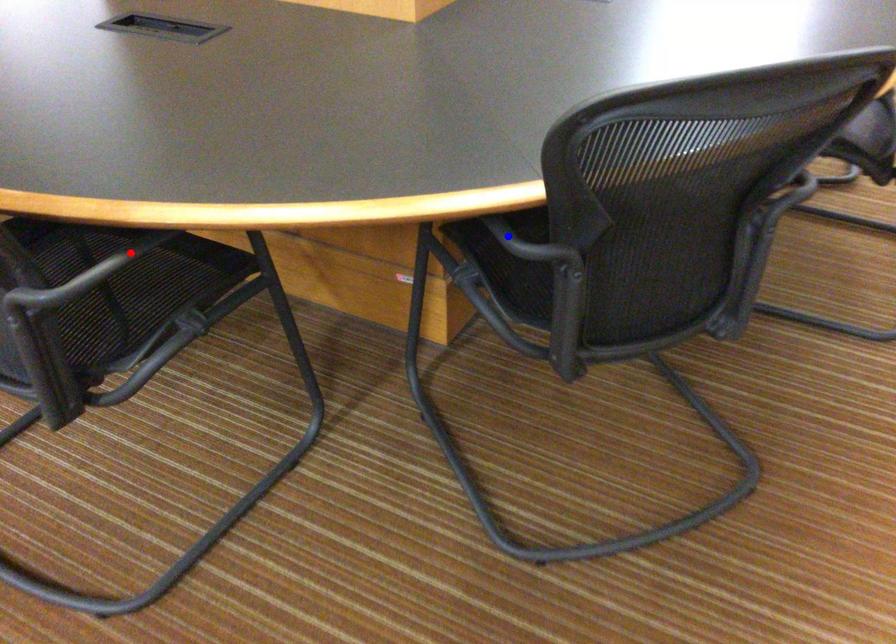
Question: Two points are marked on the image. Which point is closer to the camera?

Choices:
 (A) Blue point is closer.
 (B) Red point is closer.

Answer: (B)